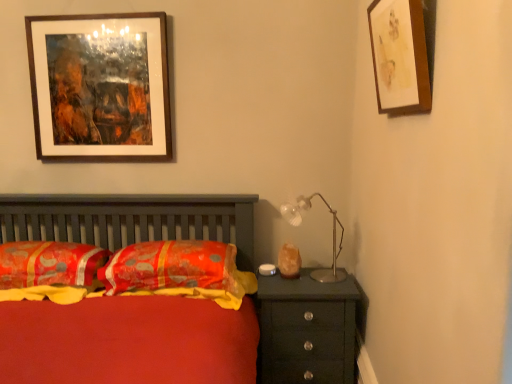
Question: Looking at their shapes, would you say wooden picture frame at upper right, which is counted as the first picture frame, starting from the front, is wider or thinner than matte black chest of drawers at right?

Choices:
 (A) thin
 (B) wide

Answer: (A)

Question: Looking at the image, does wooden picture frame at upper right, which is counted as the first picture frame, starting from the front, seem bigger or smaller compared to matte black chest of drawers at right?

Choices:
 (A) small
 (B) big

Answer: (A)

Question: Estimate the real-world distances between objects in this image. Which object is closer to the metallic silver table lamp at upper right?

Choices:
 (A) orange printed fabric pillow at center, which ranks as the first pillow in right-to-left order
 (B) matte black chest of drawers at right
 (C) silky orange pillow at center, the 1th pillow in the left-to-right sequence
 (D) wooden picture frame at upper right, which is counted as the first picture frame, starting from the front
 (E) wooden picture frame at upper left, which appears as the 1th picture frame when viewed from the back

Answer: (B)

Question: Based on their relative distances, which object is nearer to the metallic silver table lamp at upper right?

Choices:
 (A) orange printed fabric pillow at center, which ranks as the first pillow in right-to-left order
 (B) wooden picture frame at upper left, the 2th picture frame in the front-to-back sequence
 (C) silky orange pillow at center, which appears as the 2th pillow when viewed from the right
 (D) matte black chest of drawers at right
 (E) wooden picture frame at upper right, which is counted as the first picture frame, starting from the front

Answer: (D)